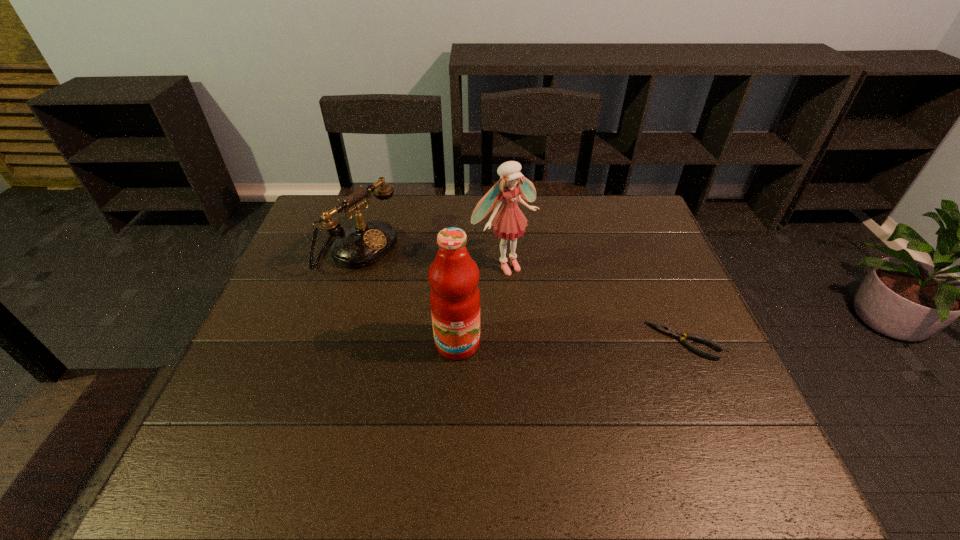
This screenshot has height=540, width=960. What are the coordinates of `fruit juice` in the screenshot? It's located at (453, 276).

This screenshot has height=540, width=960. I want to click on pliers, so click(x=675, y=334).

Locate an element on the screen. This screenshot has width=960, height=540. the shortest object is located at coordinates (675, 334).

This screenshot has width=960, height=540. Find the location of `telephone`. telephone is located at coordinates (364, 244).

Find the location of a particular element. This screenshot has height=540, width=960. the third tallest object is located at coordinates (364, 244).

This screenshot has width=960, height=540. What are the coordinates of `doll` in the screenshot? It's located at (509, 223).

Locate an element on the screen. This screenshot has height=540, width=960. vacant space situated 0.090m on the front label of the fruit juice is located at coordinates (455, 396).

You are a GUI agent. You are given a task and a screenshot of the screen. Output one action in this format:
    pyautogui.click(x=<x>, y=<y>)
    Task: Click on the vacant space located on the back of the rightmost object
    This screenshot has height=540, width=960.
    Given the screenshot: What is the action you would take?
    pyautogui.click(x=645, y=252)

Image resolution: width=960 pixels, height=540 pixels. What are the coordinates of `free point located on the dial of the second shortest object` in the screenshot? It's located at (474, 310).

Locate an element on the screen. free space located 0.130m on the dial of the second shortest object is located at coordinates (420, 283).